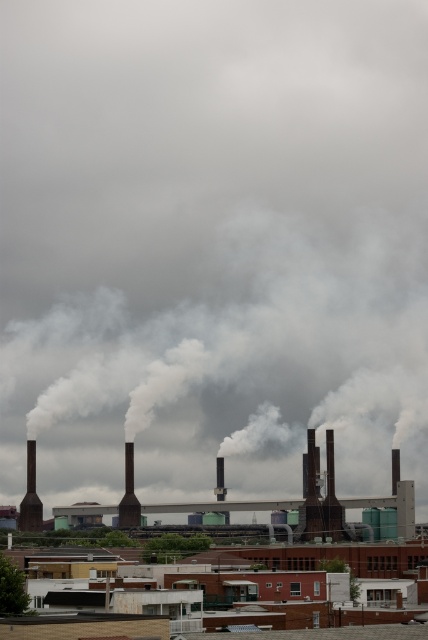
Is white smoke at center below brown industrial building at center?

Actually, white smoke at center is above brown industrial building at center.

Does white smoke at center come in front of brown industrial building at center?

No, white smoke at center is further to the viewer.

Identify the location of white smoke at center. (225, 358).

I want to click on white smoke at center, so click(225, 358).

Does smooth metallic chimney at center appear over dark brown brick chimney at left?

Yes, smooth metallic chimney at center is above dark brown brick chimney at left.

Does smooth metallic chimney at center have a lesser width compared to dark brown brick chimney at left?

Correct, smooth metallic chimney at center's width is less than dark brown brick chimney at left's.

Which is behind, point (329, 483) or point (20, 509)?

Positioned behind is point (20, 509).

Locate an element on the screen. The width and height of the screenshot is (428, 640). smooth metallic chimney at center is located at coordinates (330, 493).

From the picture: Does black matte chimney at center appear on the left side of green matte plant at center?

Correct, you'll find black matte chimney at center to the left of green matte plant at center.

Is black matte chimney at center below green matte plant at center?

Actually, black matte chimney at center is above green matte plant at center.

Is point (133, 513) farther from viewer compared to point (329, 564)?

Yes, it is behind point (329, 564).

Identify the location of black matte chimney at center. This screenshot has width=428, height=640. (128, 493).